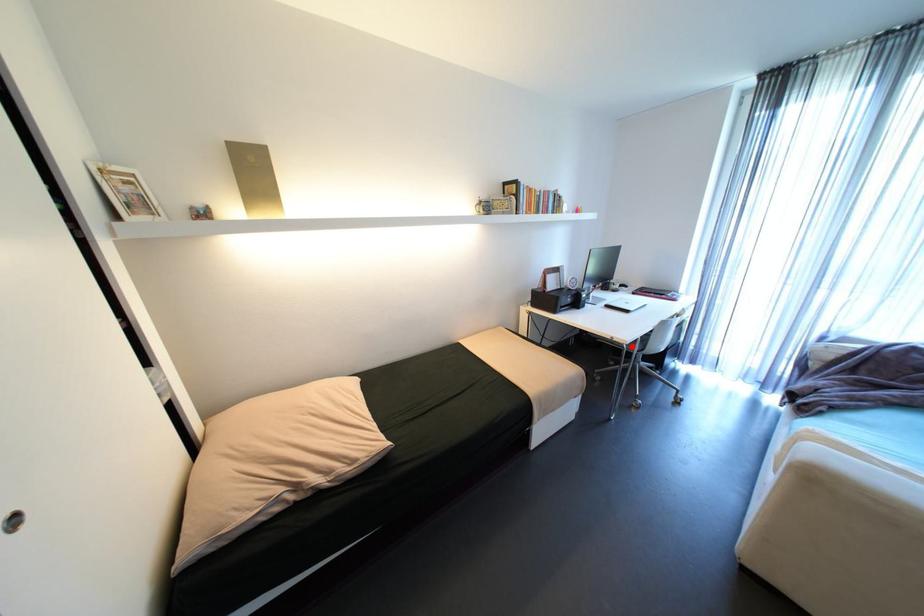
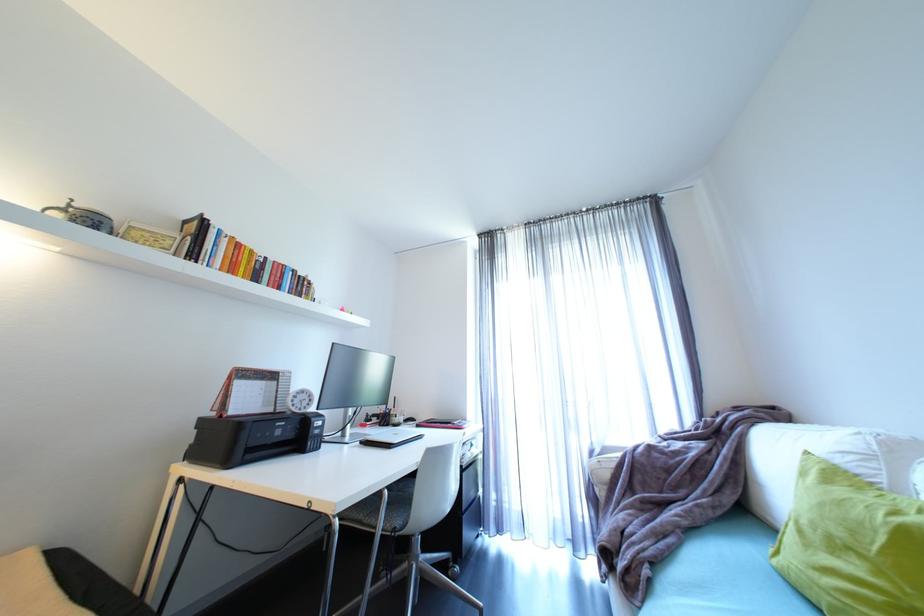
Locate, in the second image, the point that corresponds to the highlighted location in the first image.

(344, 522)